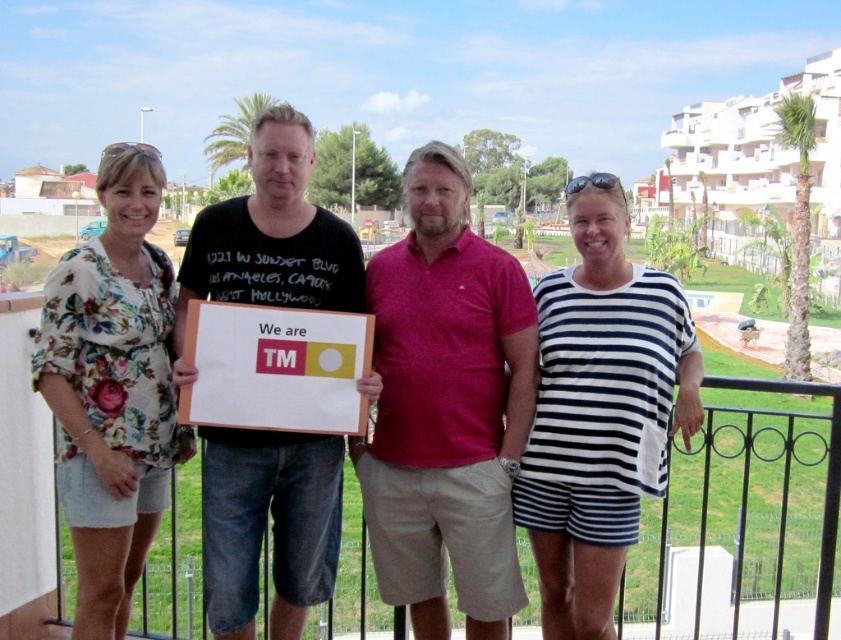
Question: Does black cotton t-shirt at center have a lesser width compared to floral fabric dress at left?

Choices:
 (A) yes
 (B) no

Answer: (A)

Question: Which point is closer to the camera taking this photo?

Choices:
 (A) (532, 339)
 (B) (128, 512)
 (C) (416, 179)
 (D) (542, 310)

Answer: (B)

Question: Is white striped dress at center to the left of matte black t-shirt at center from the viewer's perspective?

Choices:
 (A) no
 (B) yes

Answer: (A)

Question: Which point is farther to the camera?

Choices:
 (A) (334, 516)
 (B) (324, 488)

Answer: (A)

Question: Which point appears farthest from the camera in this image?

Choices:
 (A) (250, 429)
 (B) (586, 339)

Answer: (A)

Question: Does red cotton polo shirt at center have a lesser width compared to white striped dress at center?

Choices:
 (A) yes
 (B) no

Answer: (A)